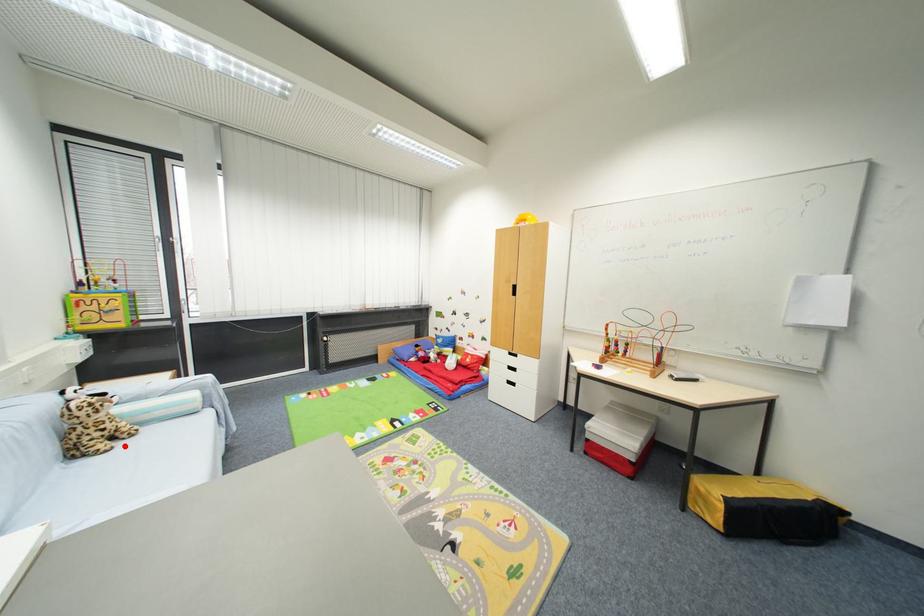
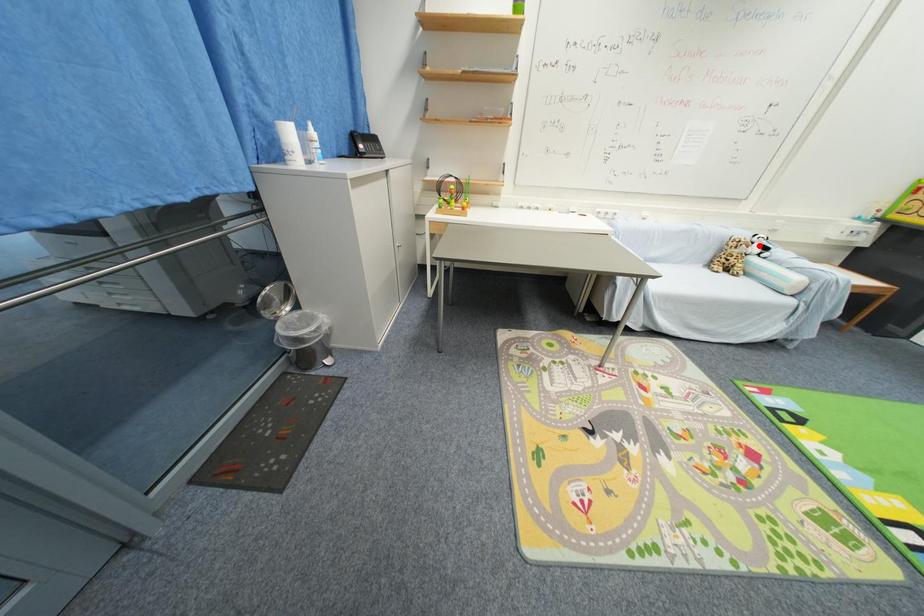
I am providing you with two images of the same scene from different viewpoints. A red point is marked on the first image and another point is marked on the second image. Is the marked point in image1 the same physical position as the marked point in image2?

No